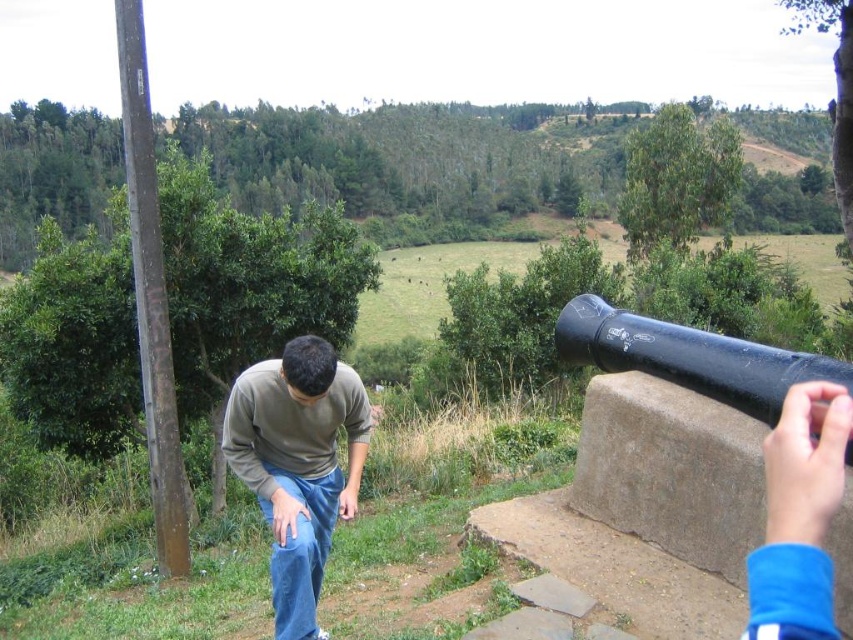
This screenshot has width=853, height=640. What do you see at coordinates (299, 465) in the screenshot?
I see `matte green sweater at center` at bounding box center [299, 465].

Can you confirm if matte green sweater at center is shorter than blue fabric hand at lower right?

No.

Between point (321, 577) and point (807, 429), which one is positioned in front?

Positioned in front is point (807, 429).

Where is `matte green sweater at center`? matte green sweater at center is located at coordinates (299, 465).

You are a GUI agent. You are given a task and a screenshot of the screen. Output one action in this format:
    pyautogui.click(x=<x>, y=<y>)
    Task: Click on the matte green sweater at center
    The height and width of the screenshot is (640, 853).
    Given the screenshot: What is the action you would take?
    pyautogui.click(x=299, y=465)

Is matte green sweater at center wider than black matte cannon at right?

In fact, matte green sweater at center might be narrower than black matte cannon at right.

Locate an element on the screen. matte green sweater at center is located at coordinates (299, 465).

In order to click on matte green sweater at center in this screenshot , I will do `click(299, 465)`.

Between blue fabric hand at lower right and black matte cannon at right, which one is positioned lower?

blue fabric hand at lower right is lower down.

Is point (798, 449) positioned before point (834, 381)?

Yes, point (798, 449) is in front of point (834, 381).

The image size is (853, 640). What are the coordinates of `blue fabric hand at lower right` in the screenshot? It's located at (799, 516).